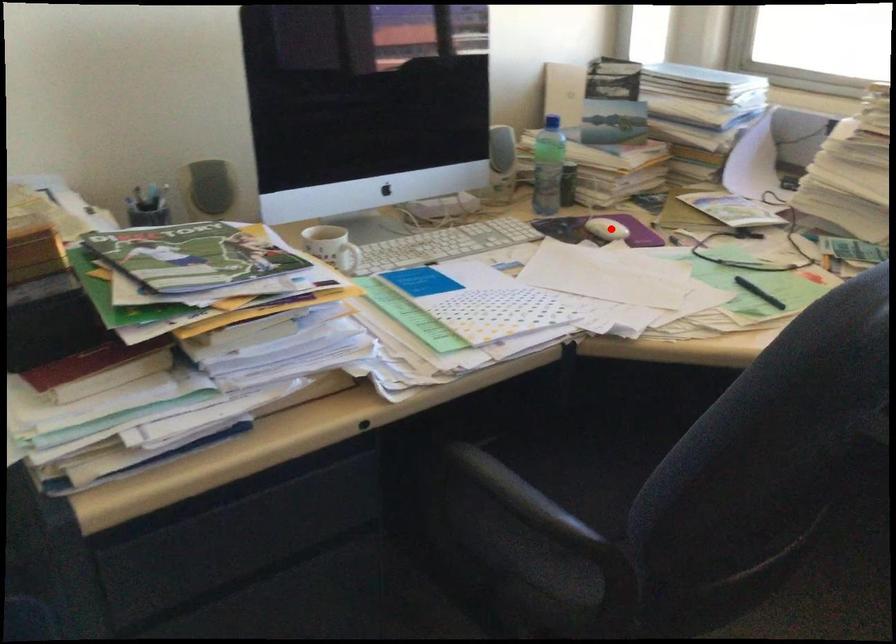
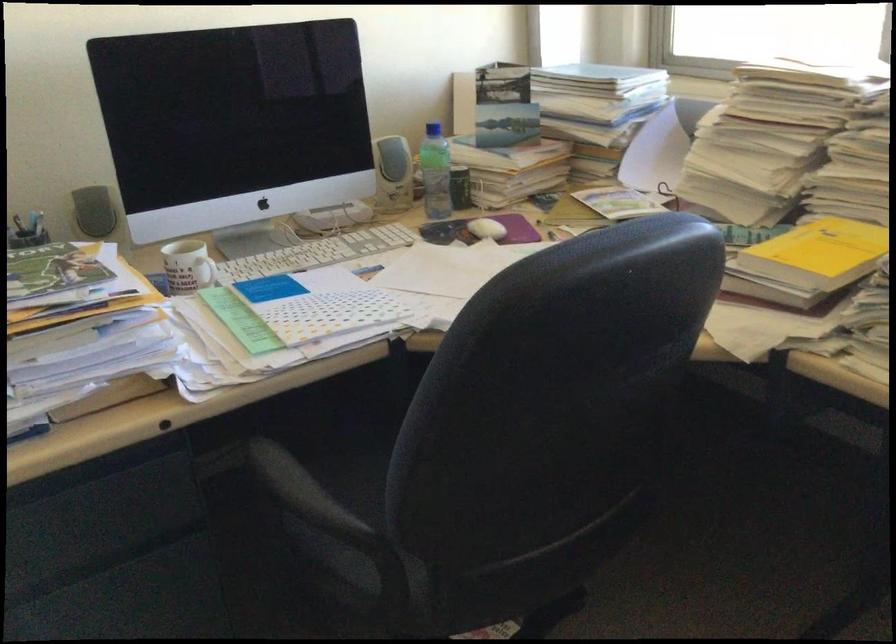
Find the pixel in the second image that matches the highlighted location in the first image.

(487, 229)